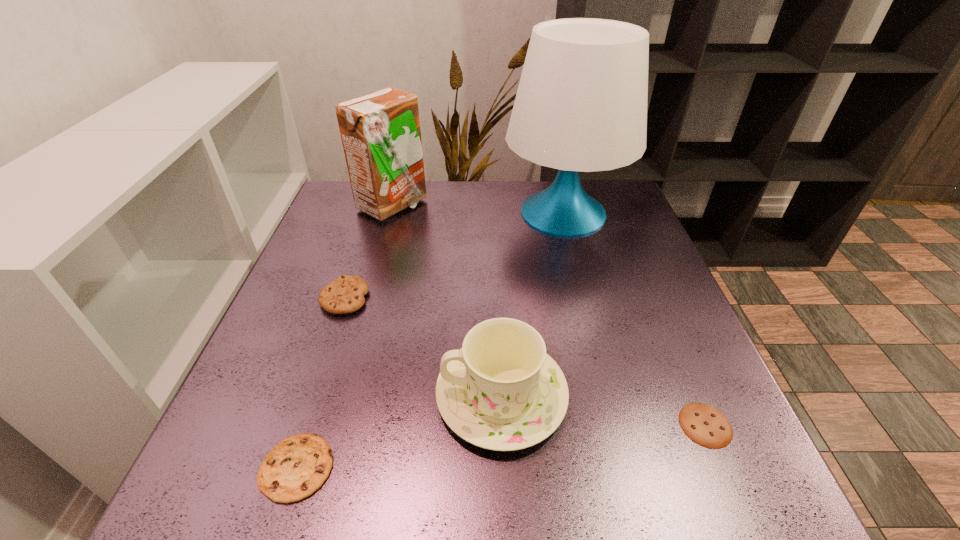
Find the location of a particular element. free space located on the handle side of the third tallest object is located at coordinates (295, 396).

Find the location of a particular element. The height and width of the screenshot is (540, 960). free space located on the handle side of the third tallest object is located at coordinates (351, 396).

You are a GUI agent. You are given a task and a screenshot of the screen. Output one action in this format:
    pyautogui.click(x=<x>, y=<y>)
    Task: Click on the free region located 0.280m on the handle side of the third tallest object
    This screenshot has height=540, width=960.
    Given the screenshot: What is the action you would take?
    pyautogui.click(x=277, y=396)

Locate an element on the screen. The image size is (960, 540). free space located 0.140m on the front of the fourth tallest object is located at coordinates (320, 372).

This screenshot has height=540, width=960. In order to click on free space located on the right of the second shortest cookie in this screenshot , I will do `click(385, 468)`.

Identify the location of free space located on the left of the rightmost cookie. (457, 425).

This screenshot has height=540, width=960. I want to click on table lamp present at the far edge, so click(x=581, y=105).

You are a GUI agent. You are given a task and a screenshot of the screen. Output one action in this format:
    pyautogui.click(x=<x>, y=<y>)
    Task: Click on the carton that is at the far edge
    The image size is (960, 540).
    Given the screenshot: What is the action you would take?
    [381, 136]

The height and width of the screenshot is (540, 960). Identify the location of object at the near edge. (295, 468).

Where is `carton at the left edge`? The image size is (960, 540). carton at the left edge is located at coordinates (381, 136).